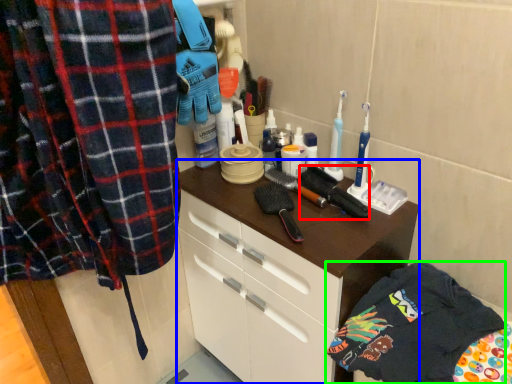
Question: Based on their relative distances, which object is nearer to brush (highlighted by a red box)? Choose from cabinetry (highlighted by a blue box) and clothing (highlighted by a green box).

Choices:
 (A) cabinetry
 (B) clothing

Answer: (A)